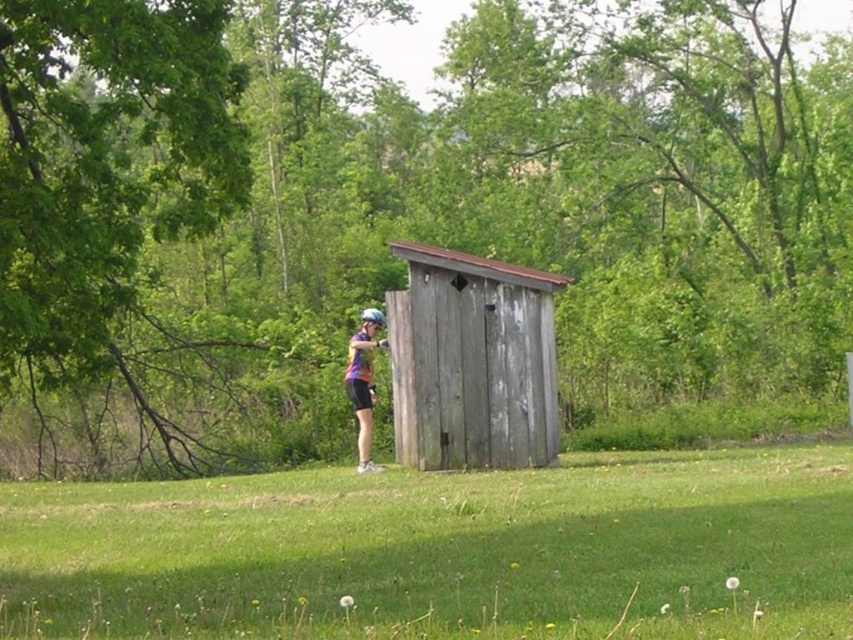
Does green grass at center come behind purple fabric helmet at center?

No, green grass at center is in front of purple fabric helmet at center.

Between green grass at center and purple fabric helmet at center, which one has less height?

Standing shorter between the two is green grass at center.

This screenshot has width=853, height=640. Describe the element at coordinates (444, 552) in the screenshot. I see `green grass at center` at that location.

Image resolution: width=853 pixels, height=640 pixels. I want to click on green grass at center, so click(444, 552).

Can you confirm if green leafy tree at upper left is smaller than purple fabric helmet at center?

Incorrect, green leafy tree at upper left is not smaller in size than purple fabric helmet at center.

Who is more distant from viewer, (x=157, y=260) or (x=373, y=342)?

The point (x=157, y=260) is behind.

Identify the location of green leafy tree at upper left. Image resolution: width=853 pixels, height=640 pixels. (401, 212).

Who is lower down, weathered wood hut at center or purple fabric helmet at center?

Positioned lower is purple fabric helmet at center.

Find the location of a particular element. weathered wood hut at center is located at coordinates (473, 362).

This screenshot has height=640, width=853. What do you see at coordinates (473, 362) in the screenshot?
I see `weathered wood hut at center` at bounding box center [473, 362].

The height and width of the screenshot is (640, 853). I want to click on weathered wood hut at center, so click(473, 362).